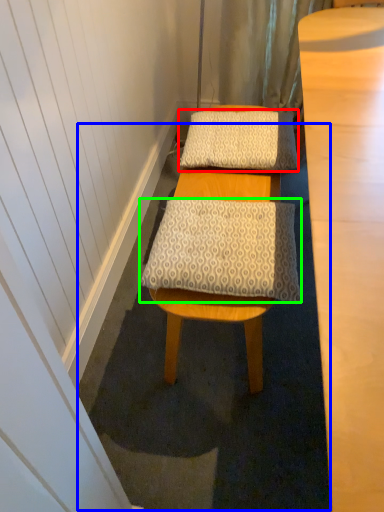
Question: Considering the real-world distances, which object is closest to pillow (highlighted by a red box)? bath mat (highlighted by a blue box) or pillow (highlighted by a green box).

Choices:
 (A) bath mat
 (B) pillow

Answer: (B)